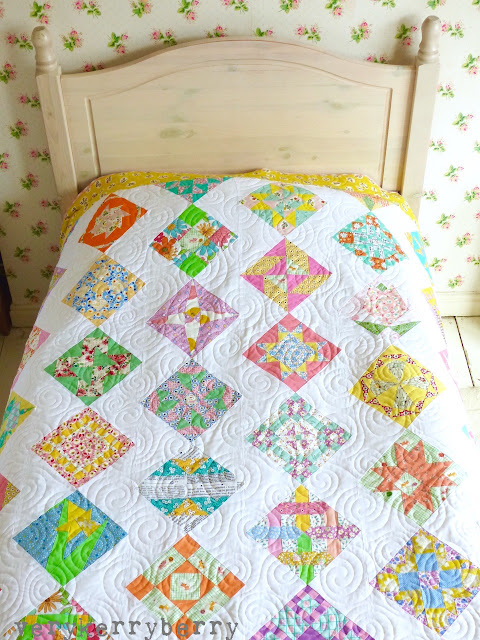
Image resolution: width=480 pixels, height=640 pixels. In order to click on wallpaper in this screenshot , I will do `click(458, 164)`.